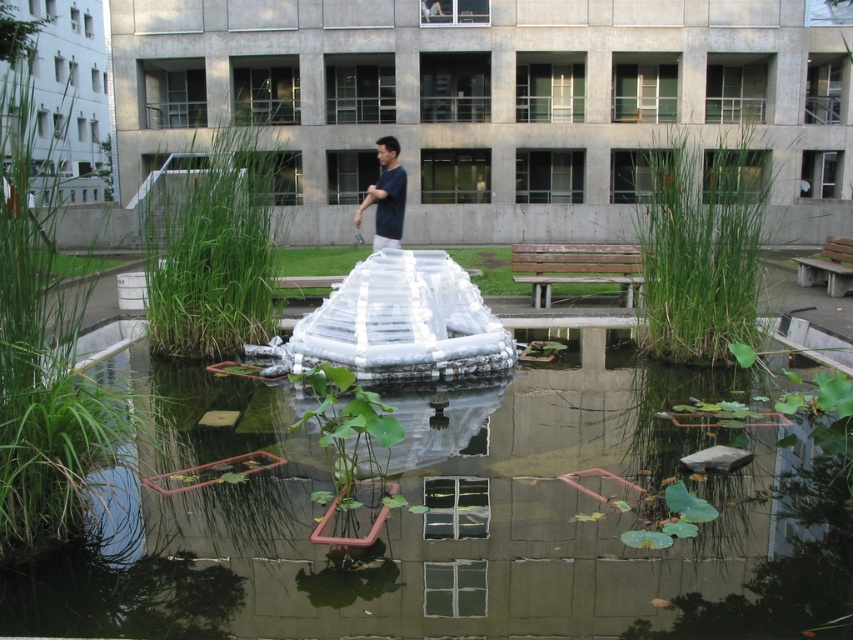
You are a photographer trying to capture the clear water at center and the dark blue shirt at center in the same frame. Which object should you focus on first if you want to ensure both are in focus without adjusting your camera settings?

The dark blue shirt at center should be focused on first because it is larger than the clear water at center, so focusing on the larger object increases the chances of both being in focus.